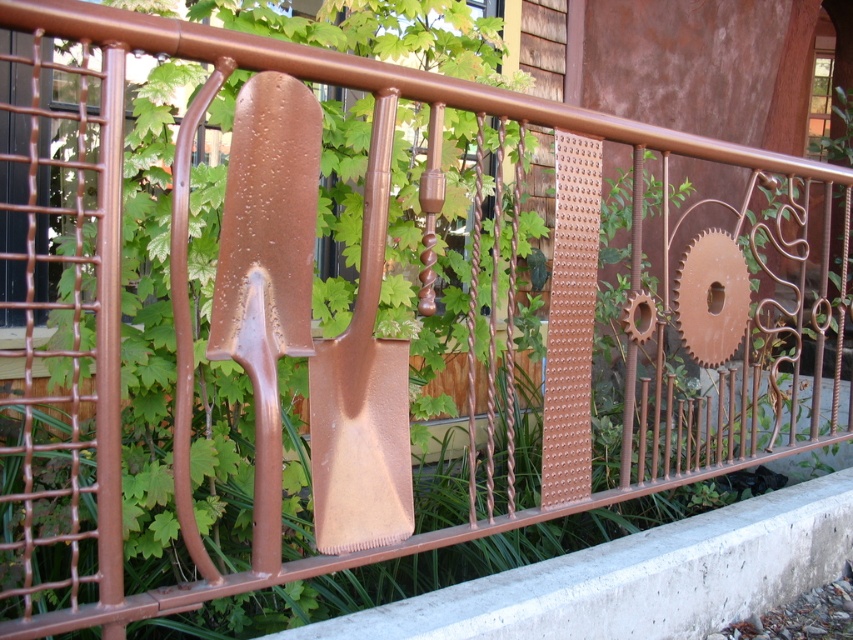
You are a gardener looking at the decorative metal railing with two shovels. Which shovel, the rusty metal shovel at center or the brown matte shovel at center, is positioned higher up?

The brown matte shovel at center is positioned higher up since the rusty metal shovel at center is located below it.

You are standing in front of the decorative metal railing. You notice two points marked on the railing. The first point is at coordinates point (281, 97) and the second point is at point (370, 362). Which of these points is nearer to you?

Point (281, 97) is closer to the camera than point (370, 362), so the first point is nearer to you.

You are a gardener who needs to choose a shovel from the decorative railing to dig a hole. Both the rusty metal shovel at center and the brown matte shovel at center are available. Which shovel is taller?

The brown matte shovel at center is taller than the rusty metal shovel at center.